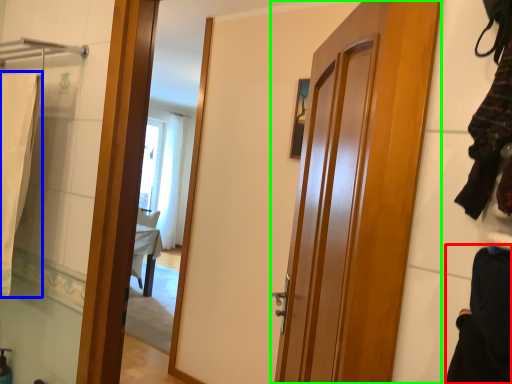
Question: Which object is positioned farthest from clothing (highlighted by a red box)? Select from bath towel (highlighted by a blue box) and door (highlighted by a green box).

Choices:
 (A) bath towel
 (B) door

Answer: (A)